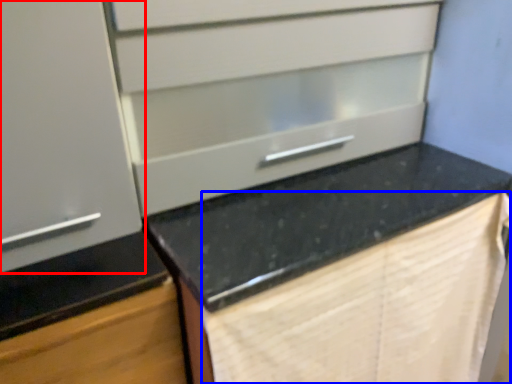
Question: Among these objects, which one is nearest to the camera, cabinetry (highlighted by a red box) or blanket (highlighted by a blue box)?

Choices:
 (A) cabinetry
 (B) blanket

Answer: (A)